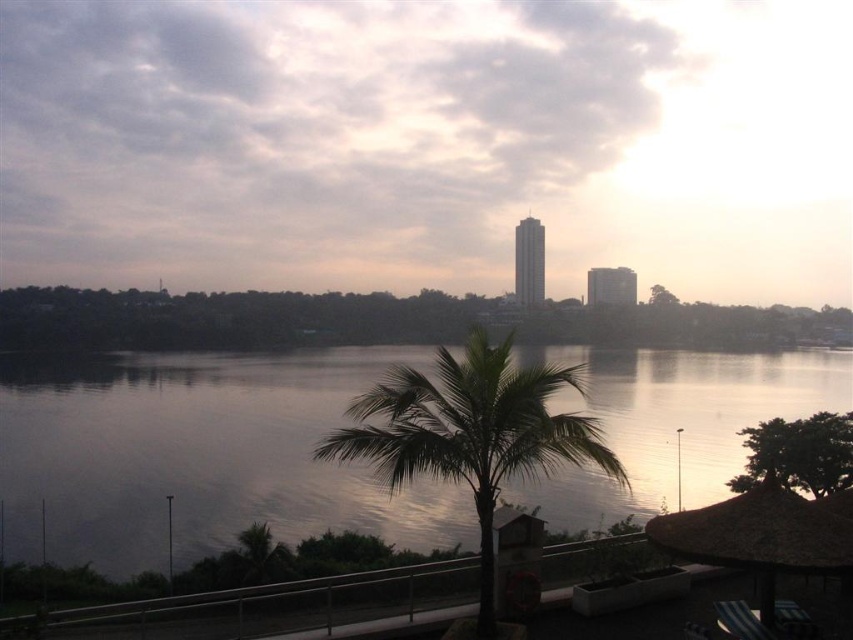
Who is positioned more to the left, silvery reflective water at center or green leafy palm tree at center?

Positioned to the left is silvery reflective water at center.

At what (x,y) coordinates should I click in order to perform the action: click on silvery reflective water at center. Please return your answer as a coordinate pair (x, y). Looking at the image, I should click on (200, 456).

The width and height of the screenshot is (853, 640). I want to click on silvery reflective water at center, so click(x=200, y=456).

Find the location of a particular element. The image size is (853, 640). silvery reflective water at center is located at coordinates tap(200, 456).